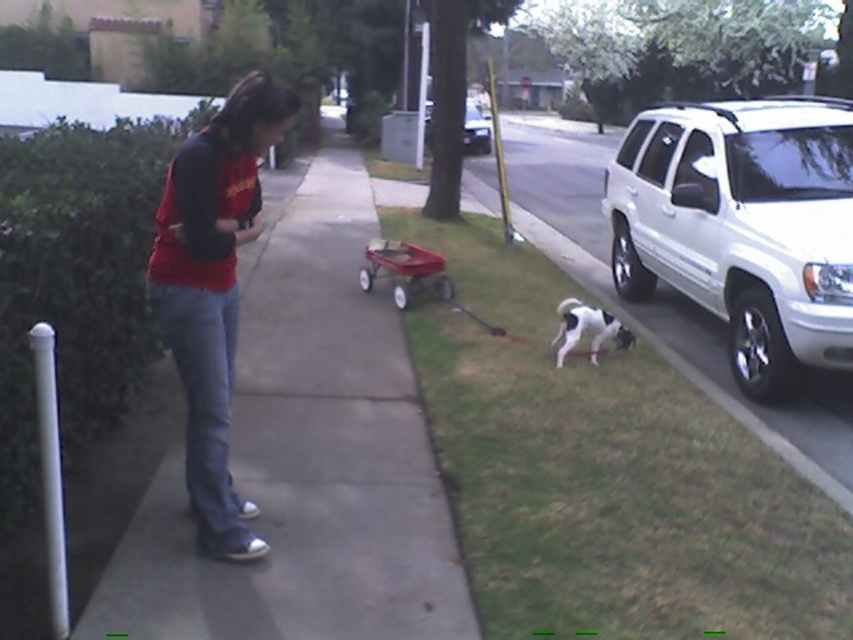
You are standing on the smooth concrete sidewalk at center. If you want to go to the red wagon on the grass, which direction should you walk relative to the sidewalk?

Since the red wagon is on the grass adjacent to the sidewalk, you should walk towards the grassy area next to the smooth concrete sidewalk at center to reach it.

You are a delivery person who needs to determine if the white and black fur dog at lower right can fit inside the white glossy suv at center. Based on their sizes, can the dog fit inside the SUV?

The white and black fur dog at lower right has a smaller size compared to the white glossy suv at center, so the dog can fit inside the SUV.